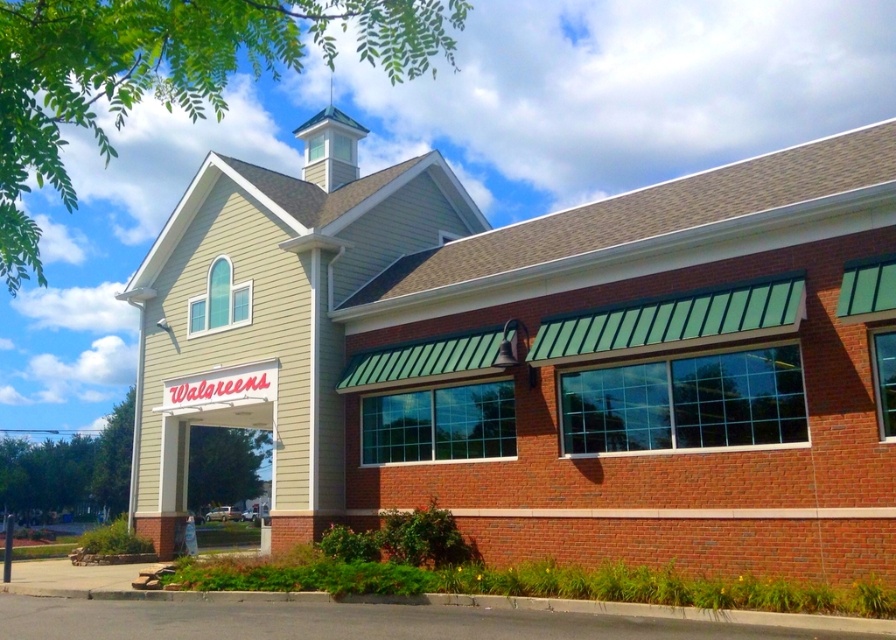
Question: Does beige siding church at center have a smaller size compared to white painted wood spire at upper center?

Choices:
 (A) no
 (B) yes

Answer: (B)

Question: Which object is farther from the camera taking this photo?

Choices:
 (A) white matte sign at center
 (B) beige siding church at center
 (C) white painted wood spire at upper center

Answer: (C)

Question: Based on their relative distances, which object is nearer to the beige siding church at center?

Choices:
 (A) white matte sign at center
 (B) white painted wood spire at upper center

Answer: (B)

Question: Which of the following is the closest to the observer?

Choices:
 (A) (748, 490)
 (B) (177, 394)
 (C) (324, 177)

Answer: (A)

Question: Does white matte sign at center appear under white painted wood spire at upper center?

Choices:
 (A) no
 (B) yes

Answer: (B)

Question: Does beige siding church at center have a lesser width compared to white painted wood spire at upper center?

Choices:
 (A) yes
 (B) no

Answer: (B)